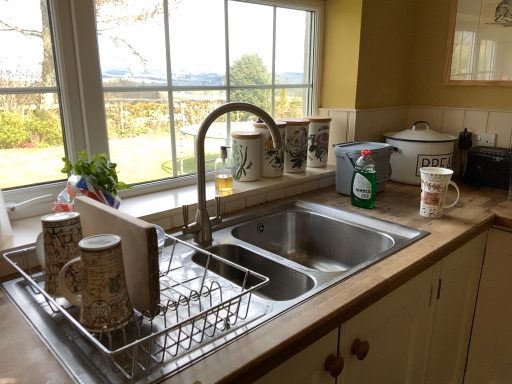
Question: Does metallic dish rack at lower left, which is the 1th appliance in left-to-right order, have a greater width compared to transparent glass window at upper right, which is the first window from right to left?

Choices:
 (A) yes
 (B) no

Answer: (A)

Question: Does metallic dish rack at lower left, which is the 1th appliance in left-to-right order, appear on the right side of transparent glass window at upper right, which is the first window from right to left?

Choices:
 (A) no
 (B) yes

Answer: (A)

Question: Is metallic dish rack at lower left, which ranks as the 4th appliance in back-to-front order, bigger than transparent glass window at upper right, which is the first window from right to left?

Choices:
 (A) yes
 (B) no

Answer: (A)

Question: Is metallic dish rack at lower left, the 4th appliance in the right-to-left sequence, with transparent glass window at upper right, which is the 2th window in left-to-right order?

Choices:
 (A) no
 (B) yes

Answer: (A)

Question: Considering the relative positions of metallic dish rack at lower left, which is the 1th appliance in left-to-right order, and transparent glass window at upper right, which is the 2th window in left-to-right order, in the image provided, is metallic dish rack at lower left, which is the 1th appliance in left-to-right order, behind transparent glass window at upper right, which is the 2th window in left-to-right order,?

Choices:
 (A) yes
 (B) no

Answer: (B)

Question: From a real-world perspective, is wooden at left above or below brushed metal faucet at center?

Choices:
 (A) above
 (B) below

Answer: (B)

Question: From the image's perspective, is wooden at left located above or below brushed metal faucet at center?

Choices:
 (A) above
 (B) below

Answer: (B)

Question: Would you say wooden at left is to the left or to the right of brushed metal faucet at center in the picture?

Choices:
 (A) left
 (B) right

Answer: (B)

Question: In the image, is wooden at left positioned in front of or behind brushed metal faucet at center?

Choices:
 (A) behind
 (B) front

Answer: (B)

Question: Looking at the image, does brown ceramic mug at left, placed as the 1th mug when sorted from left to right, seem bigger or smaller compared to transparent glass window at upper right, which is the first window from right to left?

Choices:
 (A) big
 (B) small

Answer: (B)

Question: Choose the correct answer: Is brown ceramic mug at left, placed as the 1th mug when sorted from left to right, inside transparent glass window at upper right, which is the 2th window in left-to-right order, or outside it?

Choices:
 (A) inside
 (B) outside

Answer: (B)

Question: In terms of height, does brown ceramic mug at left, which is the 2th mug from right to left, look taller or shorter compared to transparent glass window at upper right, which is the first window from right to left?

Choices:
 (A) short
 (B) tall

Answer: (A)

Question: From the image's perspective, is brown ceramic mug at left, the second mug when ordered from top to bottom, positioned above or below transparent glass window at upper right, which is the first window from right to left?

Choices:
 (A) above
 (B) below

Answer: (B)

Question: Considering the positions of green plastic container at upper right, the third appliance when ordered from left to right, and brown ceramic mug at left, which is the 1th mug in bottom-to-top order, in the image, is green plastic container at upper right, the third appliance when ordered from left to right, taller or shorter than brown ceramic mug at left, which is the 1th mug in bottom-to-top order,?

Choices:
 (A) tall
 (B) short

Answer: (A)

Question: In terms of width, does green plastic container at upper right, the third appliance when ordered from left to right, look wider or thinner when compared to brown ceramic mug at left, which is the 1th mug in bottom-to-top order?

Choices:
 (A) wide
 (B) thin

Answer: (A)